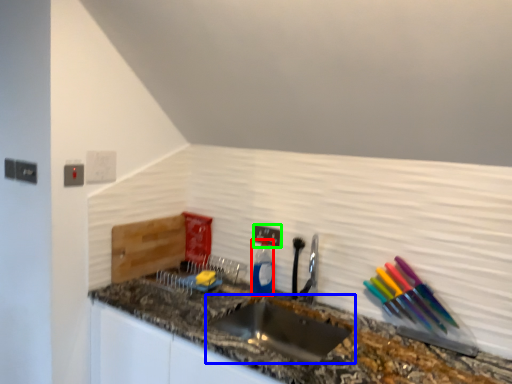
Question: Which object is positioned farthest from bottle (highlighted by a red box)? Select from sink (highlighted by a blue box) and electric outlet (highlighted by a green box).

Choices:
 (A) sink
 (B) electric outlet

Answer: (A)